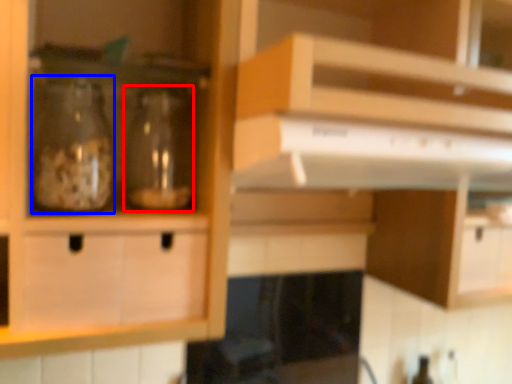
Question: Among these objects, which one is nearest to the camera, glass bottle (highlighted by a red box) or glass bottle (highlighted by a blue box)?

Choices:
 (A) glass bottle
 (B) glass bottle

Answer: (B)